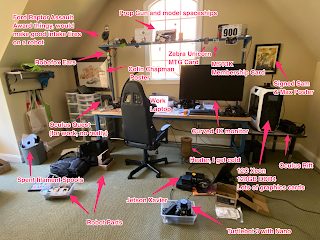
What are the coordinates of `desktop` in the screenshot? It's located at (175, 114), (97, 109).